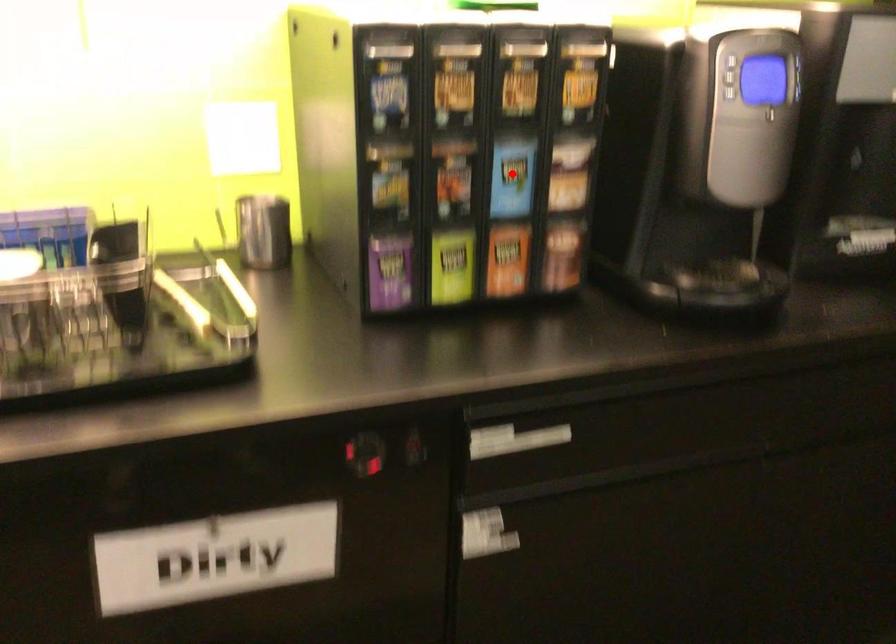
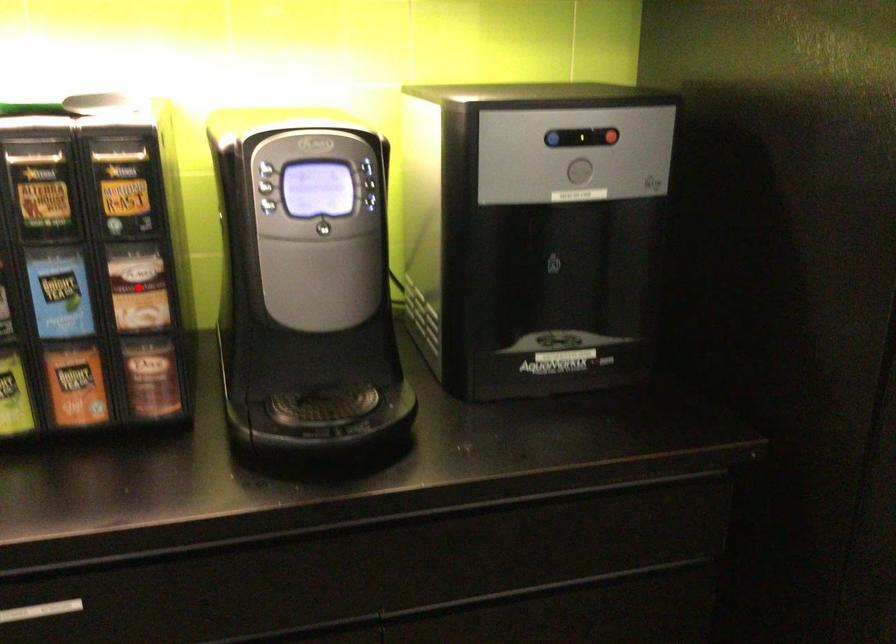
I am providing you with two images of the same scene from different viewpoints. A red point is marked on the first image and another point is marked on the second image. Does the point marked in image1 correspond to the same location as the one in image2?

No